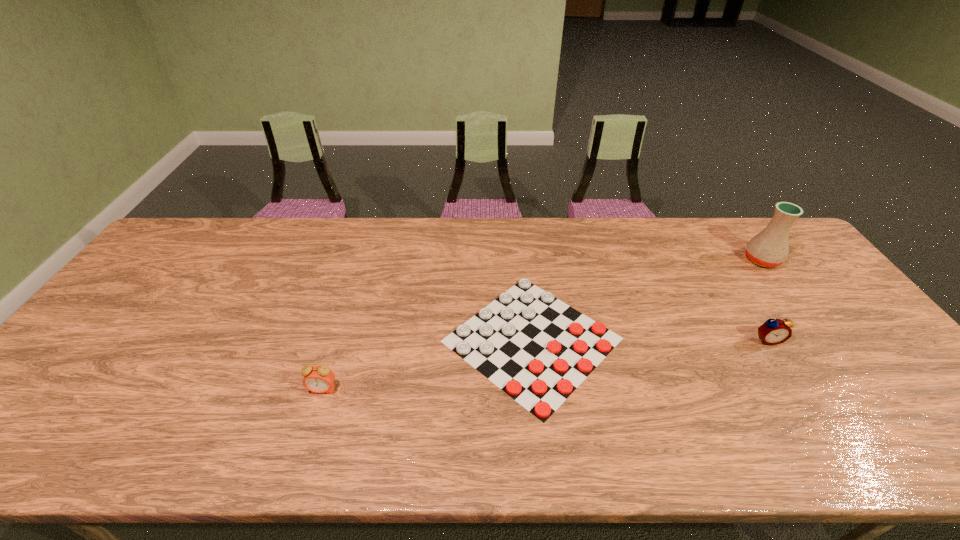
Locate an element on the screen. pottery is located at coordinates (769, 248).

Identify the location of the tallest object. (769, 248).

This screenshot has width=960, height=540. I want to click on the nearer alarm clock, so click(319, 379).

Where is `the leftmost object`? the leftmost object is located at coordinates (319, 379).

Find the location of a particular element. The width and height of the screenshot is (960, 540). the farther alarm clock is located at coordinates click(x=773, y=331).

Where is `the second object from right to left`? The height and width of the screenshot is (540, 960). the second object from right to left is located at coordinates (773, 331).

At what (x,y) coordinates should I click in order to perform the action: click on the third object from right to left. Please return your answer as a coordinate pair (x, y). The width and height of the screenshot is (960, 540). Looking at the image, I should click on (538, 352).

Where is `checkerboard`? The image size is (960, 540). checkerboard is located at coordinates (538, 352).

The image size is (960, 540). I want to click on vacant space located on the back of the rightmost object, so pyautogui.click(x=736, y=225).

Identify the location of free space located on the face of the nearer alarm clock. (315, 414).